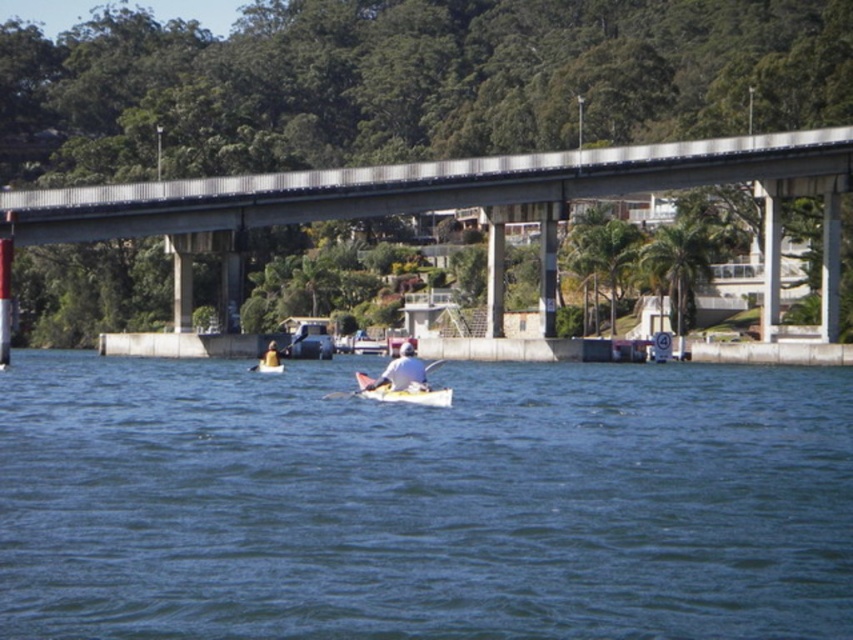
Question: Is yellow plastic paddle at center further to camera compared to white fabric kayak at center?

Choices:
 (A) yes
 (B) no

Answer: (B)

Question: Based on their relative distances, which object is farther from the yellow matte kayak at center?

Choices:
 (A) blue water at center
 (B) white matte kayak at center

Answer: (B)

Question: Considering the relative positions of concrete bridge at upper center and yellow plastic paddle at center in the image provided, where is concrete bridge at upper center located with respect to yellow plastic paddle at center?

Choices:
 (A) right
 (B) left

Answer: (A)

Question: Which point is farther from the camera taking this photo?

Choices:
 (A) (653, 480)
 (B) (833, 260)
 (C) (259, 362)

Answer: (B)

Question: Among these objects, which one is farthest from the camera?

Choices:
 (A) white matte kayak at center
 (B) yellow matte kayak at center
 (C) blue water at center
 (D) white plastic paddle at center

Answer: (B)

Question: Does white plastic canoe at center have a smaller size compared to yellow plastic paddle at center?

Choices:
 (A) yes
 (B) no

Answer: (A)